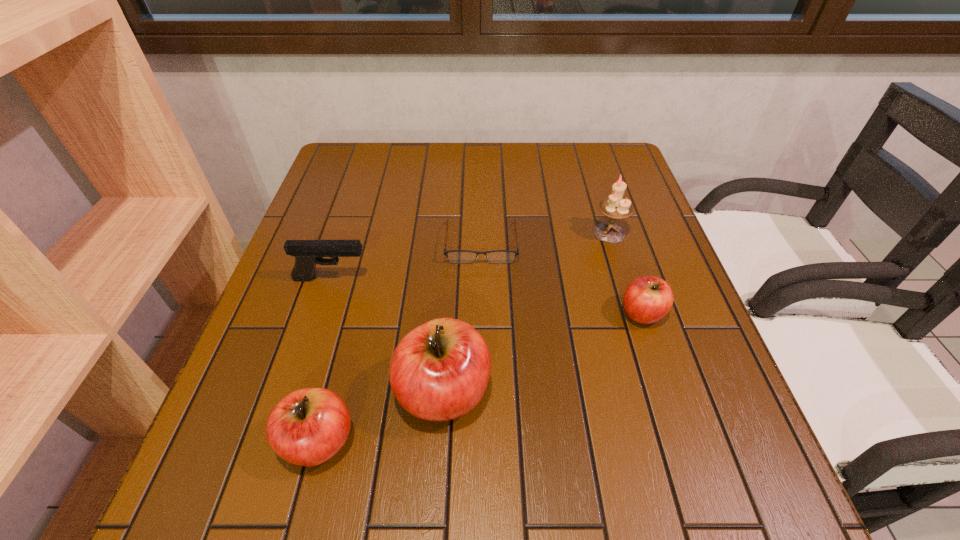
Identify the location of free space between the spectacles and the tallest apple. The width and height of the screenshot is (960, 540). (463, 317).

The image size is (960, 540). In order to click on vacant space in between the rightmost apple and the candle holder in this screenshot , I will do `click(626, 273)`.

Identify the location of the fifth closest object to the shortest object. Image resolution: width=960 pixels, height=540 pixels. point(307,427).

This screenshot has height=540, width=960. I want to click on object that can be found as the second closest to the second shortest apple, so tap(307, 253).

Identify the location of the second closest apple to the leftmost apple. This screenshot has width=960, height=540. (647, 299).

The width and height of the screenshot is (960, 540). I want to click on the second closest apple to the shortest object, so click(439, 371).

Where is `free space in the image that satisfies the following two spatial constraints: 1. on the back side of the tallest apple; 2. on the right side of the candle holder`? The height and width of the screenshot is (540, 960). free space in the image that satisfies the following two spatial constraints: 1. on the back side of the tallest apple; 2. on the right side of the candle holder is located at coordinates (454, 233).

The height and width of the screenshot is (540, 960). In order to click on free point that satisfies the following two spatial constraints: 1. on the front-facing side of the spectacles; 2. on the right side of the farthest apple in this screenshot , I will do tap(481, 314).

Find the location of a particular element. The image size is (960, 540). vacant space that satisfies the following two spatial constraints: 1. on the front-facing side of the farthest apple; 2. on the right side of the pistol is located at coordinates (321, 314).

The image size is (960, 540). I want to click on blank space that satisfies the following two spatial constraints: 1. on the front-facing side of the pistol; 2. on the right side of the second tallest apple, so click(x=278, y=441).